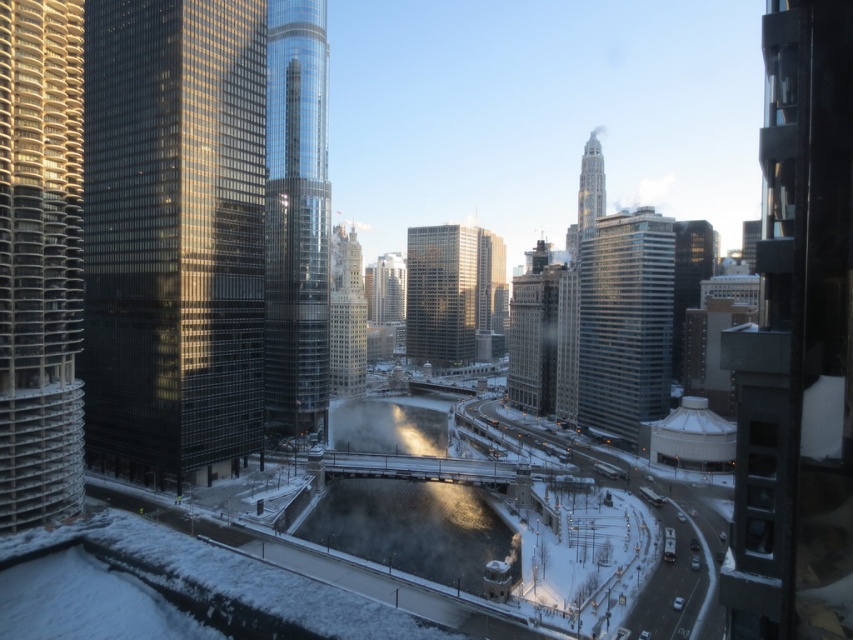
You are standing at the bridge and want to walk towards the point with coordinates point (184,132). Which direction should you move relative to point (335,369)?

You should move towards point (184,132), which is in front of point (335,369), so you need to walk forward from point (335,369) to reach it.

You are standing at the bridge looking at two points in the winter cityscape. Which point, point (91, 170) or point (503, 301), is closer to you?

Point (91, 170) is closer to the viewer than point (503, 301).

You are standing at the center of the bridge and looking towards the river. Which direction should you turn to see the shiny glass skyscraper at left?

You should turn to your left to see the shiny glass skyscraper at left since it is located at point (x=173, y=234), which is to the left of your position on the bridge.